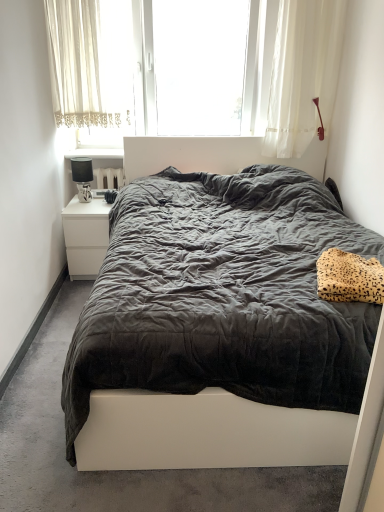
The width and height of the screenshot is (384, 512). In order to click on free space on the front side of matte black lamp at left in this screenshot , I will do `click(84, 204)`.